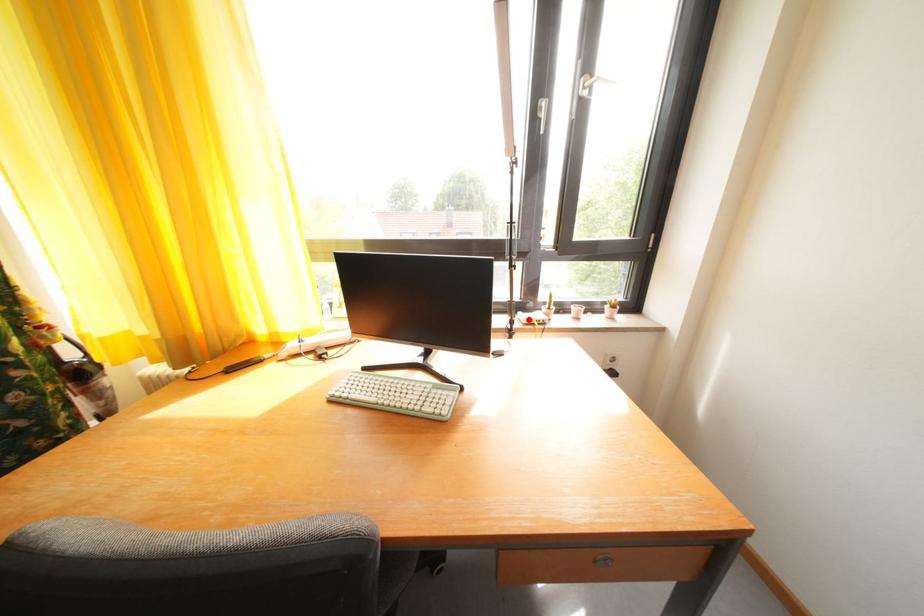
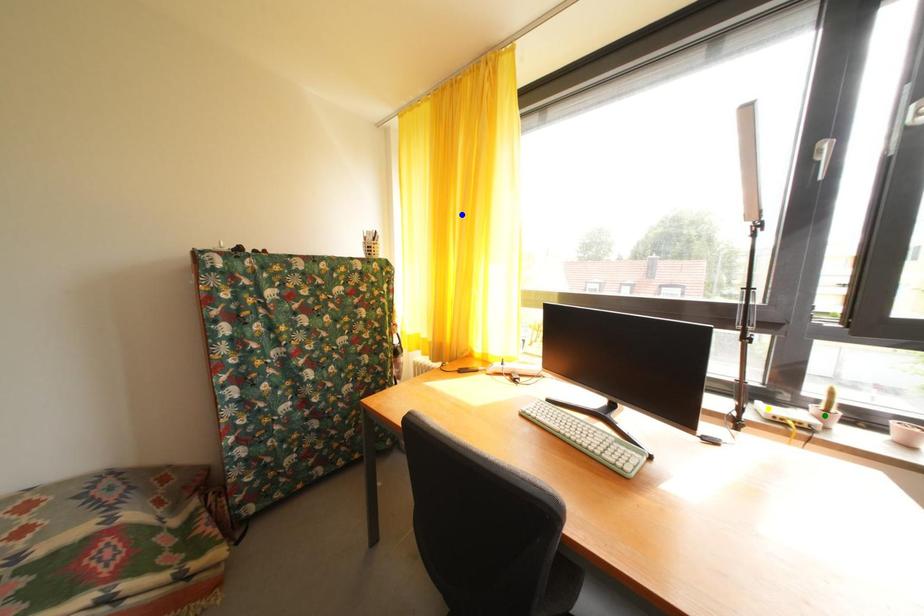
Question: I am providing you with two images of the same scene from different viewpoints. A red point is marked on the first image. You are given multiple points on the second image. In image 2, which mark is for the same physical point as the one in image 1?

Choices:
 (A) yellow point
 (B) blue point
 (C) green point

Answer: (A)